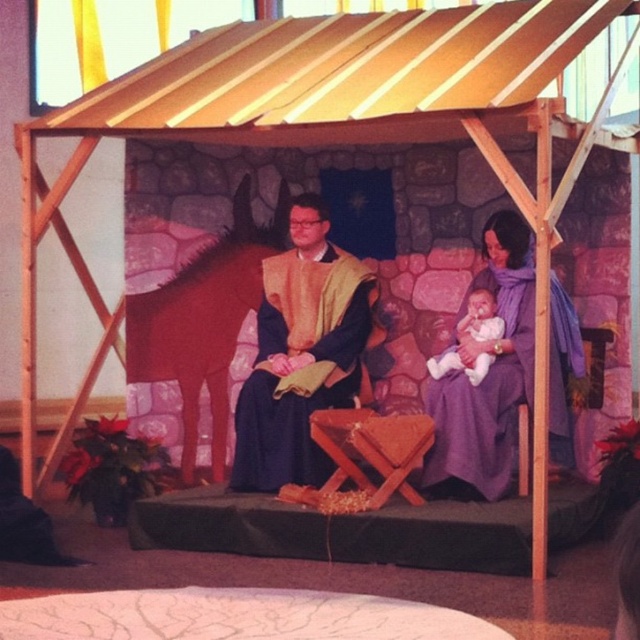
Question: Which point is closer to the camera?

Choices:
 (A) (228, 349)
 (B) (572, 456)
 (C) (477, 308)
 (D) (289, 403)

Answer: (D)

Question: Which object is positioned farthest from the matte gold robe at center?

Choices:
 (A) brown matte horse at left
 (B) purple fabric at center
 (C) soft pink fabric baby at center

Answer: (B)

Question: Can you confirm if matte gold robe at center is positioned below brown matte horse at left?

Choices:
 (A) yes
 (B) no

Answer: (A)

Question: Estimate the real-world distances between objects in this image. Which object is farther from the purple fabric at center?

Choices:
 (A) brown matte horse at left
 (B) matte gold robe at center
 (C) soft pink fabric baby at center

Answer: (A)

Question: Is matte gold robe at center to the right of purple fabric at center from the viewer's perspective?

Choices:
 (A) no
 (B) yes

Answer: (A)

Question: From the image, what is the correct spatial relationship of matte gold robe at center in relation to soft pink fabric baby at center?

Choices:
 (A) right
 (B) left

Answer: (B)